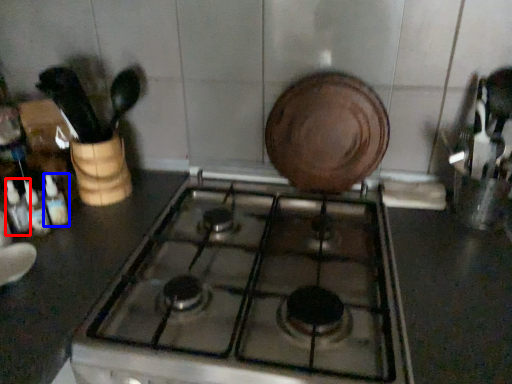
Question: Which of the following is the closest to the observer, bottle (highlighted by a red box) or bottle (highlighted by a blue box)?

Choices:
 (A) bottle
 (B) bottle

Answer: (A)